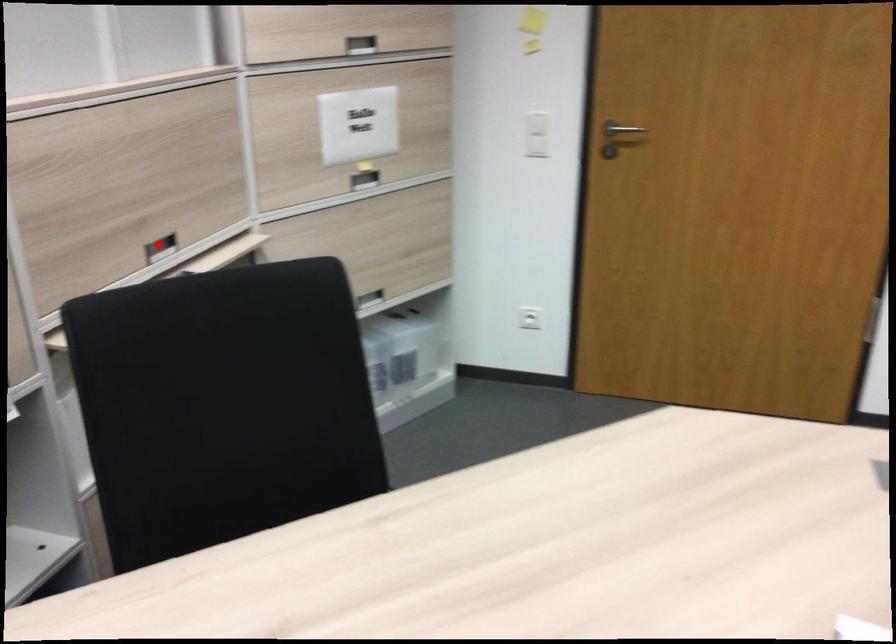
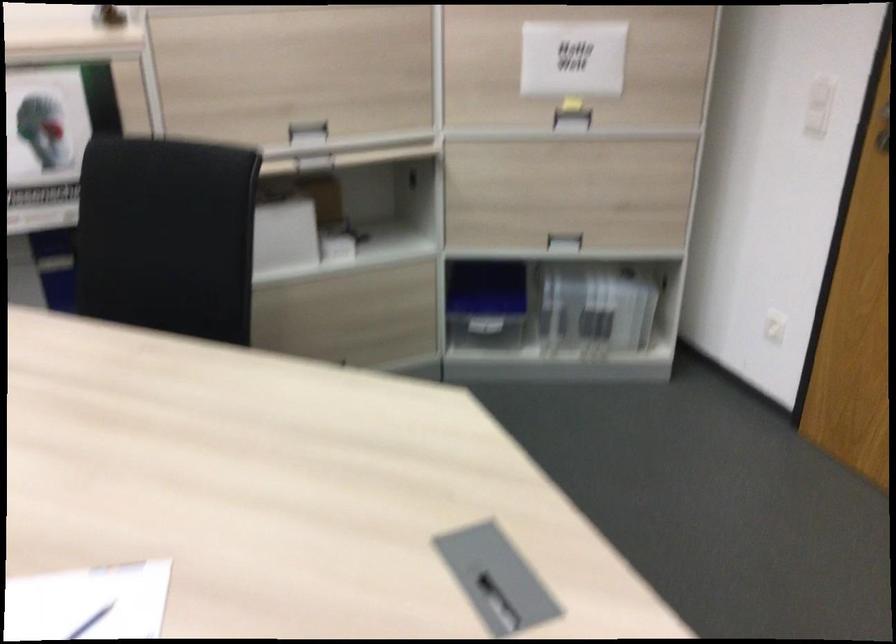
Question: A red point is marked in image1. In image2, is the corresponding 3D point closer to the camera or farther? Reply with the corresponding letter.

Choices:
 (A) The corresponding 3D point is closer.
 (B) The corresponding 3D point is farther.

Answer: (B)